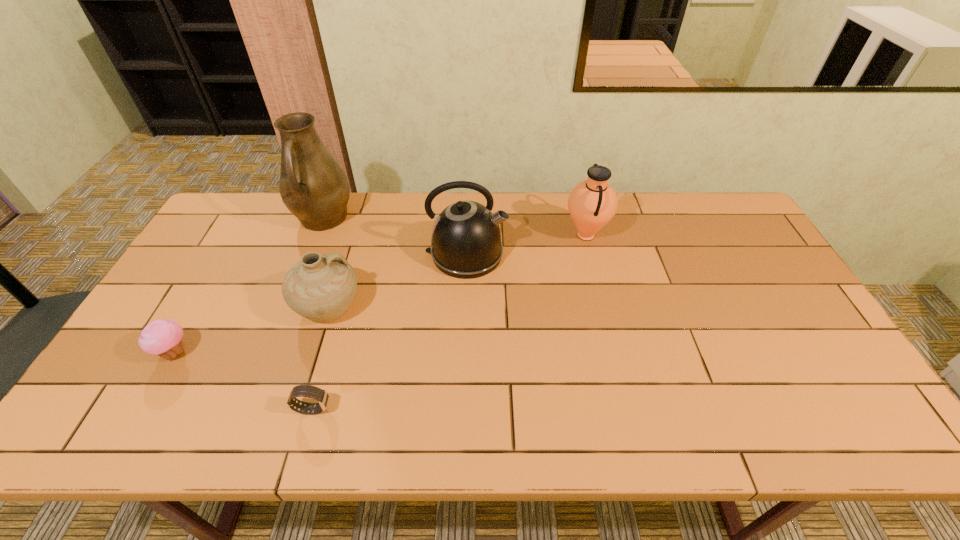
The width and height of the screenshot is (960, 540). Identify the location of watch. (321, 396).

Find the location of a particular element. vacant point located on the handle side of the tallest object is located at coordinates (301, 274).

Find the location of a particular element. The height and width of the screenshot is (540, 960). vacant space situated on the spout of the kettle is located at coordinates (533, 254).

Identify the location of blank space located on the right of the right pitcher. (682, 235).

You are a GUI agent. You are given a task and a screenshot of the screen. Output one action in this format:
    pyautogui.click(x=<x>, y=<y>)
    Task: Click on the vacant area situated 0.100m on the front of the pottery
    
    Given the screenshot: What is the action you would take?
    pyautogui.click(x=309, y=366)

At what (x,y) coordinates should I click in order to perform the action: click on free region located 0.100m on the back of the cupcake. Please return your answer as a coordinate pair (x, y). The height and width of the screenshot is (540, 960). Looking at the image, I should click on (200, 308).

Where is `blank area located on the face of the nearest object`? Image resolution: width=960 pixels, height=540 pixels. blank area located on the face of the nearest object is located at coordinates (353, 409).

Find the location of a particular element. kettle at the far edge is located at coordinates (466, 243).

This screenshot has width=960, height=540. Find the location of `object that is at the near edge`. object that is at the near edge is located at coordinates (321, 396).

The image size is (960, 540). Find the location of `object positioned at the left edge`. object positioned at the left edge is located at coordinates (163, 337).